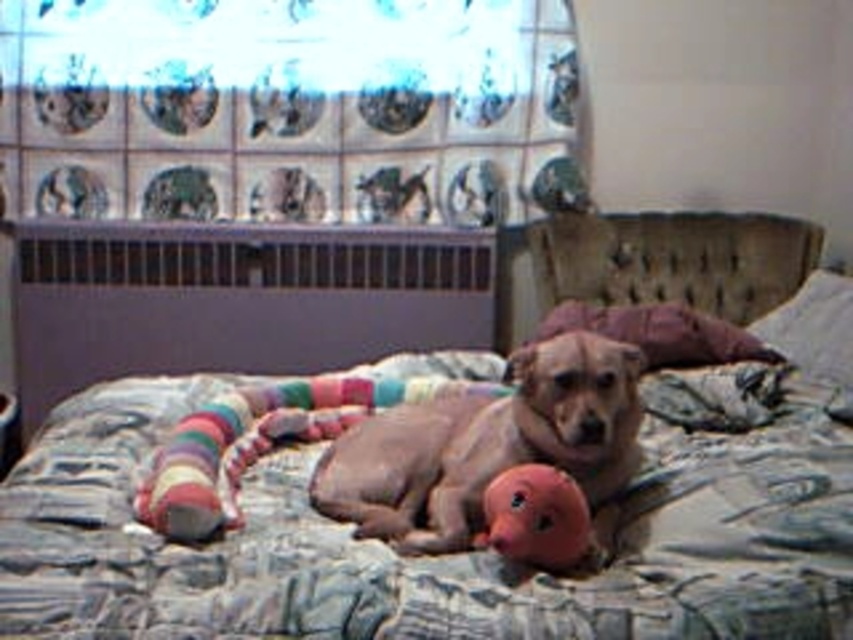
You are a toy that needs to be placed between the textured fabric bed at center and the pink rubber duck at center. Which object should you place the toy closer to in order to be closer to the viewer?

You should place the toy closer to the textured fabric bed at center because it is closer to the viewer than the pink rubber duck at center.

You are a photographer setting up a shoot in this room. You want to place a new camera on the purple fabric pillow at upper right to capture the brown matte dog at center. Will the camera be in the dog s line of sight?

The brown matte dog at center is below the purple fabric pillow at upper right, so the camera placed on the purple fabric pillow at upper right will be above the dog. Since the dog is looking directly at the camera, the position should be within its line of sight as it is facing the camera direction.

You are a pet sitter and need to place a new toy between the brown matte dog at center and the purple fabric pillow at center. Based on their positions, where should you place the toy so it is between them?

The brown matte dog at center is below the purple fabric pillow at center, so placing the toy between them would require positioning it above the dog and below the pillow.